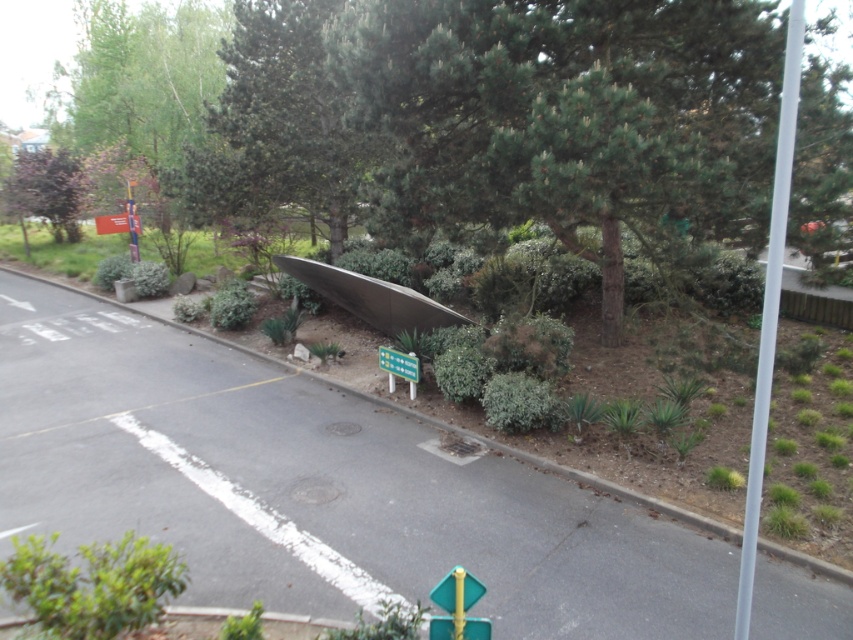
Question: Among these points, which one is farthest from the camera?

Choices:
 (A) (447, 637)
 (B) (120, 556)
 (C) (817, 179)

Answer: (C)

Question: Can you confirm if green textured tree at upper center is smaller than green leafy bush at lower left?

Choices:
 (A) no
 (B) yes

Answer: (A)

Question: In this image, where is green plastic sign at lower center located relative to metallic rectangular sign at upper left?

Choices:
 (A) right
 (B) left

Answer: (A)

Question: Which of the following is the closest to the observer?

Choices:
 (A) green matte traffic sign at center
 (B) green textured tree at center
 (C) green leafy bush at lower left

Answer: (A)

Question: Does green plastic sign at lower center have a smaller size compared to metallic rectangular sign at upper left?

Choices:
 (A) yes
 (B) no

Answer: (A)

Question: Which of the following is the closest to the observer?

Choices:
 (A) (469, 620)
 (B) (463, 596)
 (C) (402, 232)

Answer: (A)